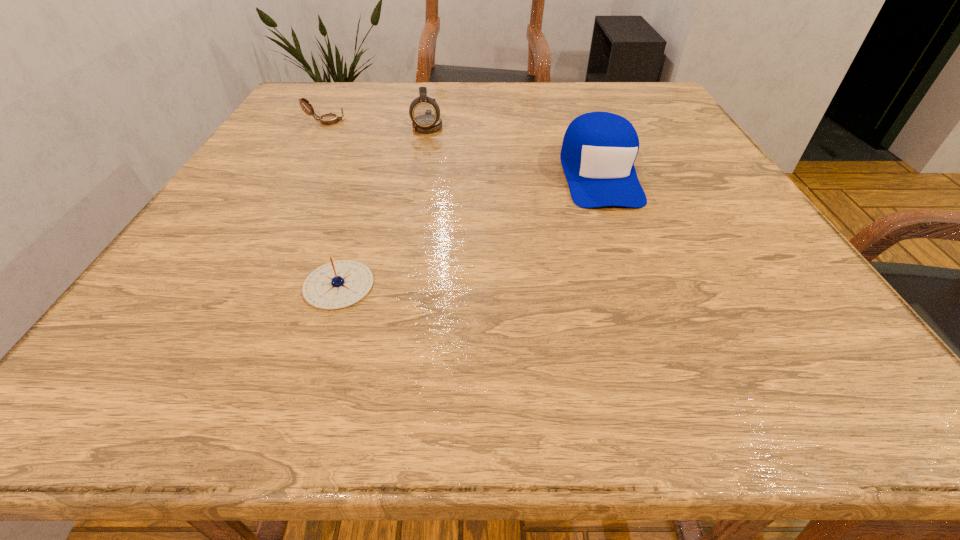
Identify the location of blank space located 0.150m on the left of the nearest object. (204, 285).

The image size is (960, 540). Find the location of `object that is at the left edge`. object that is at the left edge is located at coordinates (327, 119).

Where is `object at the far left corner`? The image size is (960, 540). object at the far left corner is located at coordinates (327, 119).

In order to click on vacant region at the far edge of the desktop in this screenshot , I will do [x=472, y=116].

This screenshot has width=960, height=540. Identify the location of free region at the near edge of the desktop. (635, 362).

The height and width of the screenshot is (540, 960). Find the location of `vacant region at the left edge`. vacant region at the left edge is located at coordinates (140, 308).

At what (x,y) coordinates should I click in order to perform the action: click on free space at the right edge of the desktop. Please return your answer as a coordinate pair (x, y). This screenshot has width=960, height=540. Looking at the image, I should click on (652, 180).

Locate an element on the screen. Image resolution: width=960 pixels, height=540 pixels. free space at the far left corner is located at coordinates (343, 92).

In order to click on free point at the near left corner in this screenshot , I will do 124,378.

Image resolution: width=960 pixels, height=540 pixels. I want to click on vacant space at the far right corner of the desktop, so [630, 98].